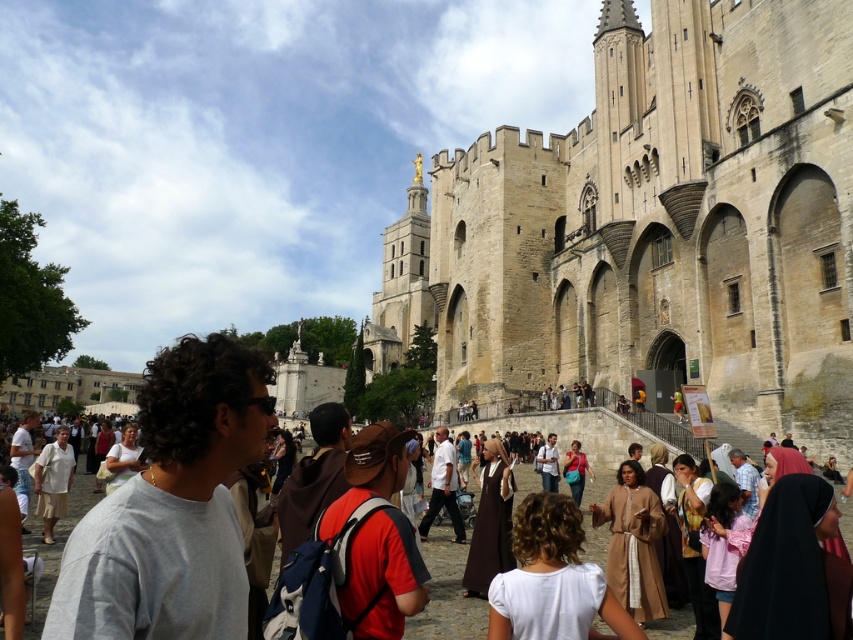
Question: Is light brown leather jacket at center in front of matte red dress at center?

Choices:
 (A) yes
 (B) no

Answer: (B)

Question: Estimate the real-world distances between objects in this image. Which object is farther from the beige stone church at center?

Choices:
 (A) gray cotton t-shirt at center
 (B) beige cotton skirt at lower left
 (C) light gray t-shirt at center

Answer: (B)

Question: Based on their relative distances, which object is farther from the gray cotton t-shirt at center?

Choices:
 (A) white cotton dress at center
 (B) light gray t-shirt at center
 (C) beige cotton skirt at lower left

Answer: (B)

Question: Among these points, which one is nearest to the camera?

Choices:
 (A) (465, 588)
 (B) (785, 573)
 (C) (24, 532)

Answer: (B)

Question: Does white cotton shirt at center appear on the right side of brown cloth at center?

Choices:
 (A) yes
 (B) no

Answer: (B)

Question: Can you confirm if gray cotton t-shirt at center is wider than white cotton shirt at center?

Choices:
 (A) no
 (B) yes

Answer: (B)